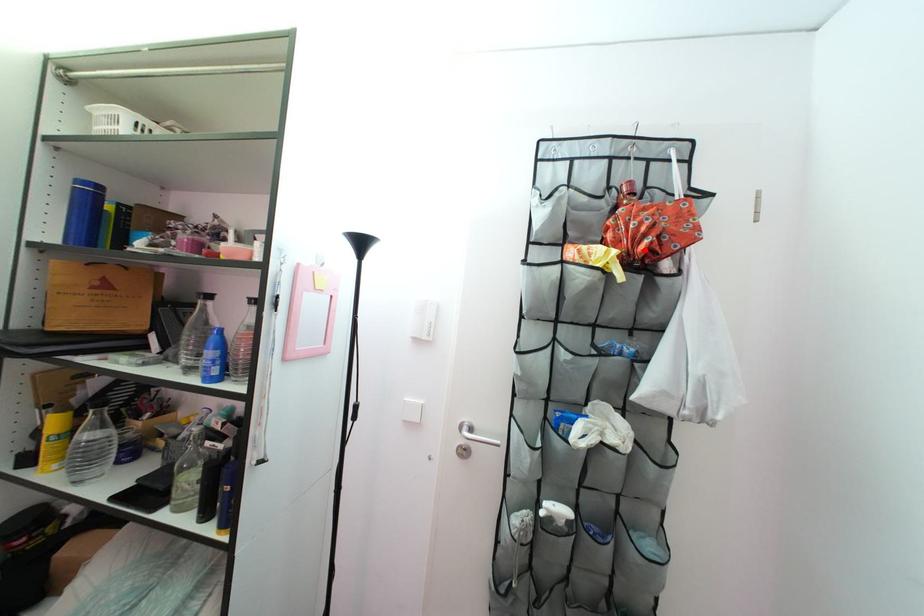
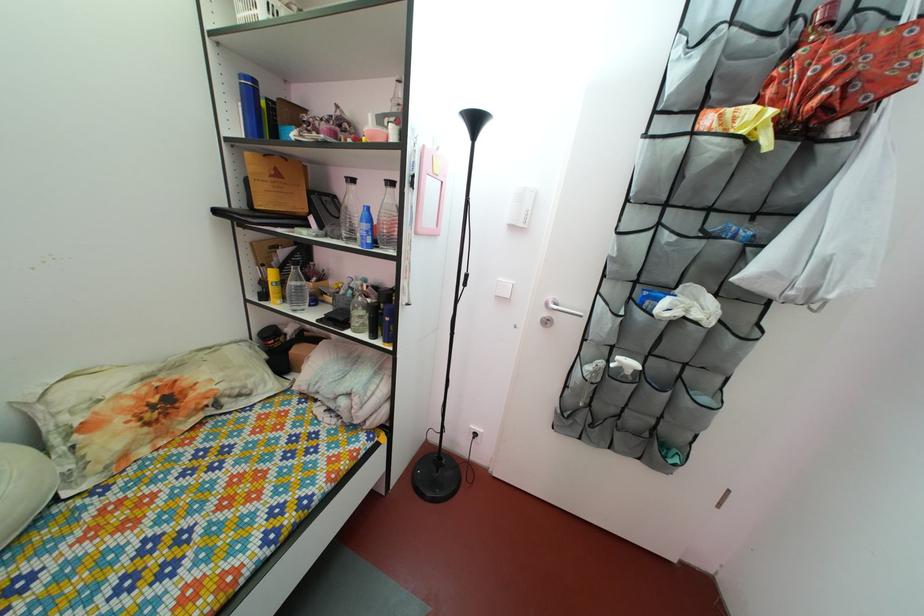
Question: I am providing you with two images of the same scene from different viewpoints. A red point is shown in image1. For the corresponding object point in image2, is it positioned nearer or farther from the camera?

Choices:
 (A) Nearer
 (B) Farther

Answer: (B)